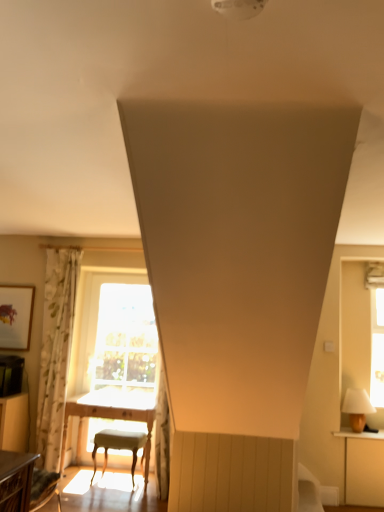
At what (x,y) coordinates should I click in order to perform the action: click on light gray fabric stool at center. Please return your answer as a coordinate pair (x, y). The height and width of the screenshot is (512, 384). Looking at the image, I should click on tap(119, 446).

What is the approximate height of matte wooden picture frame at upper left?

matte wooden picture frame at upper left is 69.02 centimeters tall.

At what (x,y) coordinates should I click in order to perform the action: click on light wood table at center, the first table in the back-to-front sequence. Please return your answer as a coordinate pair (x, y). This screenshot has width=384, height=512. Looking at the image, I should click on (111, 415).

Identify the location of matte white lampshade at right. (357, 408).

Is matte white lampshade at right in front of light gray fabric stool at center?

That is True.

From the image's perspective, between matte white lampshade at right and light gray fabric stool at center, who is located below?

light gray fabric stool at center, from the image's perspective.

This screenshot has width=384, height=512. I want to click on chair directly beneath the matte white lampshade at right (from a real-world perspective), so click(x=119, y=446).

What's the angular difference between matte white lampshade at right and light gray fabric stool at center's facing directions?

The angle between the facing direction of matte white lampshade at right and the facing direction of light gray fabric stool at center is 1.22 degrees.

From a real-world perspective, is matte wooden picture frame at upper left below wooden table at lower left, which is the 1th table from top to bottom?

No, from a real-world perspective, matte wooden picture frame at upper left is not under wooden table at lower left, which is the 1th table from top to bottom.

Looking at this image, can you confirm if matte wooden picture frame at upper left is shorter than wooden table at lower left, acting as the first table starting from the front?

In fact, matte wooden picture frame at upper left may be taller than wooden table at lower left, acting as the first table starting from the front.

Does matte wooden picture frame at upper left turn towards wooden table at lower left, which is the 1th table from top to bottom?

No, matte wooden picture frame at upper left is not aimed at wooden table at lower left, which is the 1th table from top to bottom.

Can we say matte wooden picture frame at upper left lies outside wooden table at lower left, placed as the 2th table when sorted from back to front?

Indeed, matte wooden picture frame at upper left is completely outside wooden table at lower left, placed as the 2th table when sorted from back to front.

Is floral fabric curtain at left not inside light gray fabric stool at center?

Absolutely, floral fabric curtain at left is external to light gray fabric stool at center.

Considering the relative sizes of floral fabric curtain at left and light gray fabric stool at center in the image provided, is floral fabric curtain at left taller than light gray fabric stool at center?

Indeed, floral fabric curtain at left has a greater height compared to light gray fabric stool at center.

Where is `chair located underneath the floral fabric curtain at left (from a real-world perspective)`? The image size is (384, 512). chair located underneath the floral fabric curtain at left (from a real-world perspective) is located at coordinates (119, 446).

Can you confirm if floral fabric curtain at left is positioned to the right of light gray fabric stool at center?

In fact, floral fabric curtain at left is to the left of light gray fabric stool at center.

Is matte wooden picture frame at upper left facing towards light gray fabric stool at center?

No, matte wooden picture frame at upper left is not aimed at light gray fabric stool at center.

Looking at this image, is matte wooden picture frame at upper left shorter than light gray fabric stool at center?

In fact, matte wooden picture frame at upper left may be taller than light gray fabric stool at center.

Measure the distance between matte wooden picture frame at upper left and light gray fabric stool at center.

A distance of 4.50 feet exists between matte wooden picture frame at upper left and light gray fabric stool at center.

Does matte wooden picture frame at upper left appear on the right side of light gray fabric stool at center?

Incorrect, matte wooden picture frame at upper left is not on the right side of light gray fabric stool at center.

Considering the positions of objects floral fabric curtain at left and matte white lampshade at right in the image provided, who is behind, floral fabric curtain at left or matte white lampshade at right?

Positioned behind is floral fabric curtain at left.

From a real-world perspective, between floral fabric curtain at left and matte white lampshade at right, who is vertically higher?

floral fabric curtain at left, from a real-world perspective.

From the image's perspective, does floral fabric curtain at left appear higher than matte white lampshade at right?

Correct, floral fabric curtain at left appears higher than matte white lampshade at right in the image.

Considering the sizes of objects floral fabric curtain at left and matte white lampshade at right in the image provided, who is thinner, floral fabric curtain at left or matte white lampshade at right?

floral fabric curtain at left is thinner.

Is light wood table at center, arranged as the 1th table when ordered from the bottom, taller than matte white lampshade at right?

Yes.

From a real-world perspective, which object stands above the other?

matte white lampshade at right is physically above.

The width and height of the screenshot is (384, 512). I want to click on table lamp above the light wood table at center, the first table in the back-to-front sequence (from the image's perspective), so 357,408.

From a real-world perspective, between light wood table at center, the second table in the top-to-bottom sequence, and floral fabric curtain at left, who is vertically higher?

floral fabric curtain at left.

Is light wood table at center, arranged as the 1th table when ordered from the bottom, outside of floral fabric curtain at left?

Indeed, light wood table at center, arranged as the 1th table when ordered from the bottom, is completely outside floral fabric curtain at left.

Is light wood table at center, the second table in the top-to-bottom sequence, facing towards floral fabric curtain at left?

No, light wood table at center, the second table in the top-to-bottom sequence, is not facing towards floral fabric curtain at left.

You are a GUI agent. You are given a task and a screenshot of the screen. Output one action in this format:
    pyautogui.click(x=<x>, y=<y>)
    Task: Click on the chair behind the matte white lampshade at right
    The image size is (384, 512).
    Given the screenshot: What is the action you would take?
    pyautogui.click(x=119, y=446)

Image resolution: width=384 pixels, height=512 pixels. Find the location of `picture frame that is above the wooden table at lower left, which is the second table from bottom to top (from a real-world perspective)`. picture frame that is above the wooden table at lower left, which is the second table from bottom to top (from a real-world perspective) is located at coordinates (16, 316).

When comparing their distances from light gray fabric stool at center, does wooden table at lower left, placed as the 2th table when sorted from back to front, or matte white lampshade at right seem further?

matte white lampshade at right is further to light gray fabric stool at center.

Based on their spatial positions, is wooden table at lower left, acting as the first table starting from the front, or floral fabric curtain at left further from light gray fabric stool at center?

wooden table at lower left, acting as the first table starting from the front, is further to light gray fabric stool at center.

When comparing their distances from light gray fabric stool at center, does matte white lampshade at right or light wood table at center, the 2th table from the front, seem closer?

light wood table at center, the 2th table from the front.

From the image, which object appears to be nearer to matte wooden picture frame at upper left, wooden table at lower left, which is the second table from bottom to top, or floral fabric curtain at left?

floral fabric curtain at left is positioned closer to the anchor matte wooden picture frame at upper left.

Which object lies nearer to the anchor point wooden table at lower left, placed as the 2th table when sorted from back to front, light wood table at center, the first table in the back-to-front sequence, or light gray fabric stool at center?

light gray fabric stool at center is positioned closer to the anchor wooden table at lower left, placed as the 2th table when sorted from back to front.

Based on their spatial positions, is matte wooden picture frame at upper left or light gray fabric stool at center further from floral fabric curtain at left?

light gray fabric stool at center is positioned further to the anchor floral fabric curtain at left.

When comparing their distances from matte wooden picture frame at upper left, does matte white lampshade at right or light gray fabric stool at center seem closer?

Based on the image, light gray fabric stool at center appears to be nearer to matte wooden picture frame at upper left.

When comparing their distances from matte wooden picture frame at upper left, does wooden table at lower left, which is the second table from bottom to top, or light wood table at center, the 2th table from the front, seem further?

The object further to matte wooden picture frame at upper left is wooden table at lower left, which is the second table from bottom to top.

You are a GUI agent. You are given a task and a screenshot of the screen. Output one action in this format:
    pyautogui.click(x=<x>, y=<y>)
    Task: Click on the chair located between floral fabric curtain at left and matte white lampshade at right in the left-right direction
    The height and width of the screenshot is (512, 384).
    Given the screenshot: What is the action you would take?
    pyautogui.click(x=119, y=446)

The image size is (384, 512). I want to click on table between wooden table at lower left, placed as the 2th table when sorted from back to front, and matte white lampshade at right from left to right, so click(111, 415).

In order to click on chair between wooden table at lower left, acting as the first table starting from the front, and matte wooden picture frame at upper left from front to back in this screenshot , I will do `click(119, 446)`.

I want to click on curtain that lies between matte wooden picture frame at upper left and light gray fabric stool at center from top to bottom, so click(56, 351).